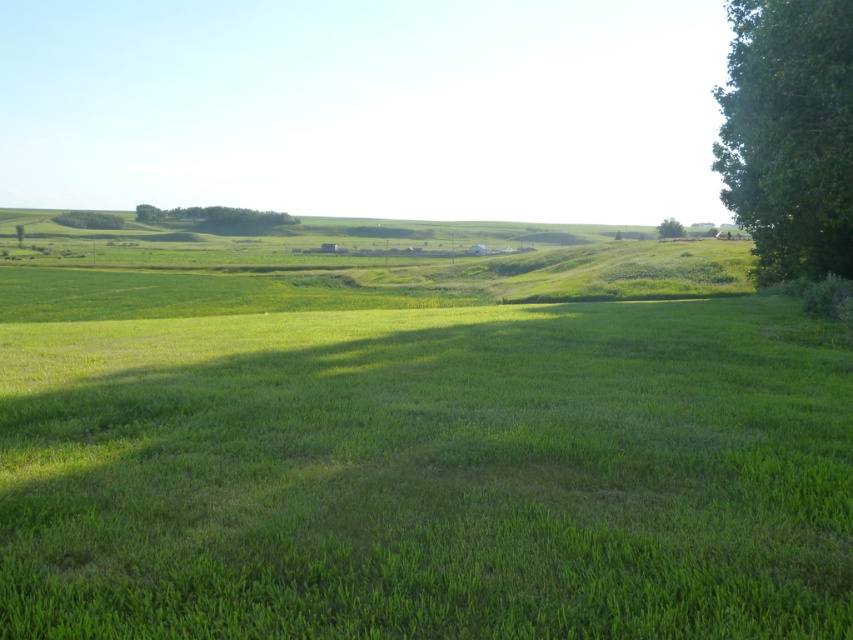
Measure the distance from green leafy tree at upper left to green leafy tree at upper right.

715.86 feet

Is the position of green leafy tree at upper left less distant than that of green leafy tree at upper right?

No, it is behind green leafy tree at upper right.

Locate an element on the screen. green leafy tree at upper left is located at coordinates (90, 220).

This screenshot has width=853, height=640. I want to click on green leafy tree at upper left, so click(90, 220).

This screenshot has width=853, height=640. Describe the element at coordinates (788, 134) in the screenshot. I see `green leafy tree at right` at that location.

Does point (799, 49) lie behind point (144, 220)?

No.

This screenshot has width=853, height=640. In order to click on green leafy tree at right in this screenshot , I will do `click(788, 134)`.

Locate an element on the screen. The image size is (853, 640). green leafy tree at right is located at coordinates (788, 134).

Who is positioned more to the left, green leafy tree at right or green leafy tree at upper right?

green leafy tree at right

Between point (834, 179) and point (663, 230), which one is positioned behind?

Point (663, 230)

Where is `green leafy tree at right`? This screenshot has height=640, width=853. green leafy tree at right is located at coordinates (788, 134).